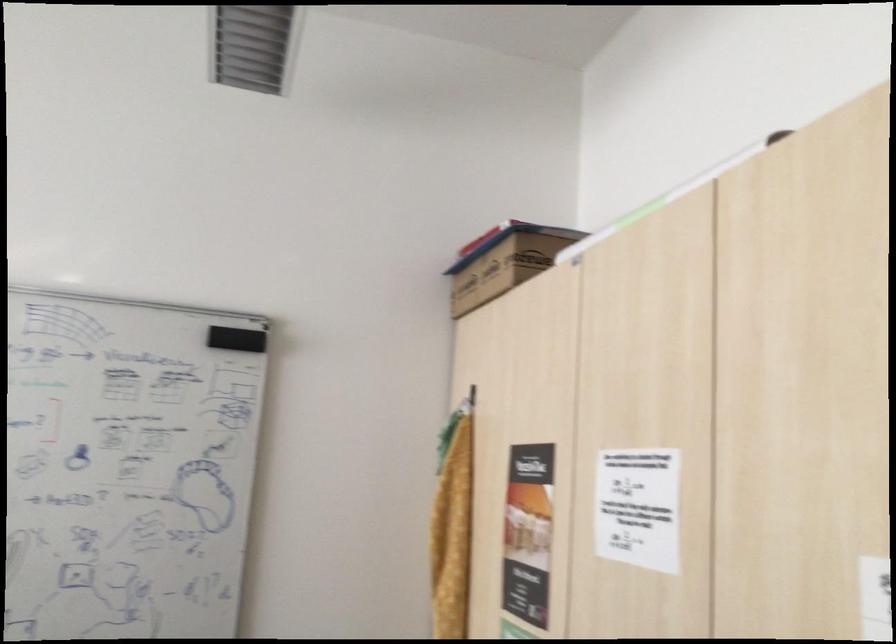
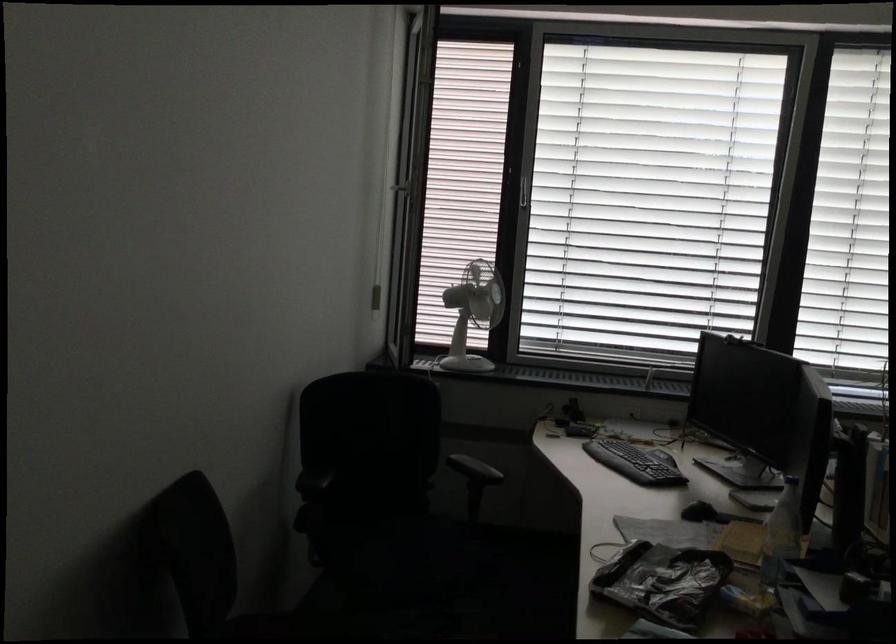
Question: The images are taken continuously from a first-person perspective. In which direction is your viewpoint rotating?

Choices:
 (A) Left
 (B) Right
 (C) Up
 (D) Down

Answer: (A)